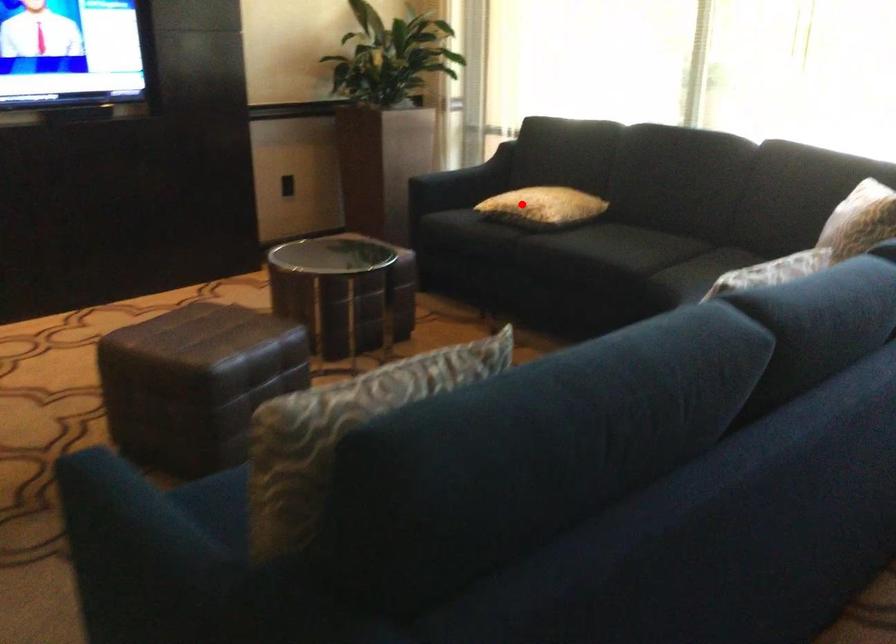
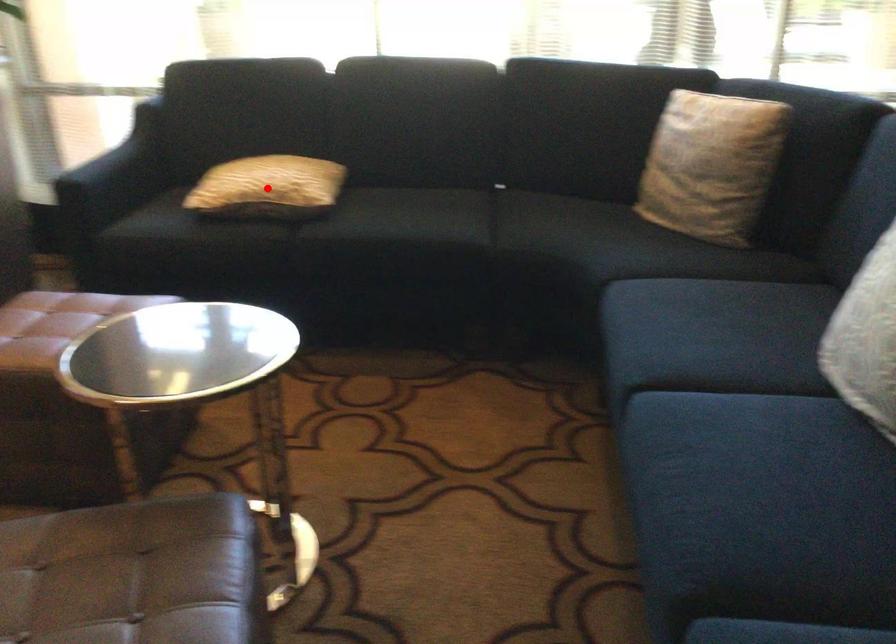
I am providing you with two images of the same scene from different viewpoints. A red point is marked on the first image and another point is marked on the second image. Are the points marked in image1 and image2 representing the same 3D position?

Yes